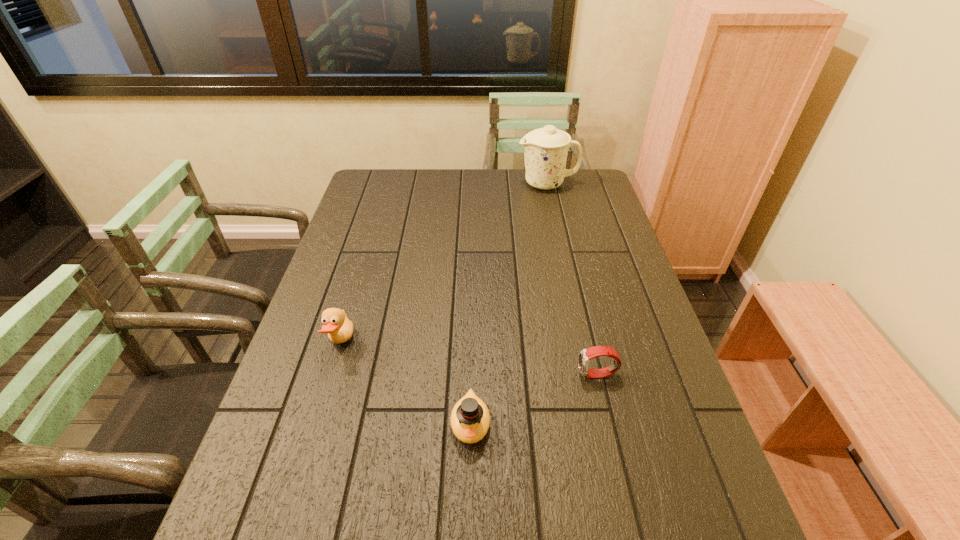
This screenshot has width=960, height=540. Identify the location of the farthest object. (545, 149).

Locate an element on the screen. The width and height of the screenshot is (960, 540). chinaware is located at coordinates (545, 149).

Image resolution: width=960 pixels, height=540 pixels. Find the location of `the taller duck`. the taller duck is located at coordinates (339, 328).

Find the location of `the farther duck`. the farther duck is located at coordinates (339, 328).

Where is `the shorter duck`? the shorter duck is located at coordinates (470, 419).

The height and width of the screenshot is (540, 960). I want to click on the nearest object, so click(470, 419).

Image resolution: width=960 pixels, height=540 pixels. In order to click on the shortest object in this screenshot , I will do `click(585, 355)`.

Identify the location of vacant point located 0.080m on the spout of the farthest object. (496, 184).

You are a GUI agent. You are given a task and a screenshot of the screen. Output one action in this format:
    pyautogui.click(x=<x>, y=<y>)
    Task: Click on the vacant region located on the spout of the farthest object
    The image size is (960, 540).
    Given the screenshot: What is the action you would take?
    pyautogui.click(x=493, y=184)

Find the location of a particular element. blank space located 0.150m on the spout of the farthest object is located at coordinates (478, 184).